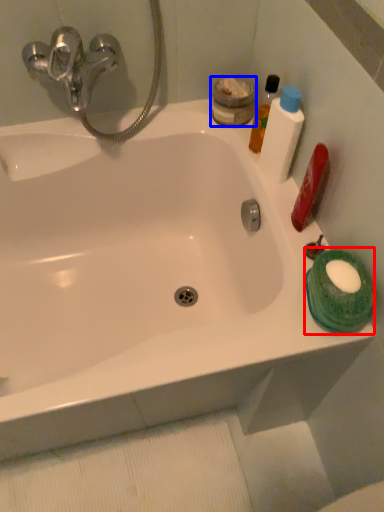
Question: Which point is closer to the camera, mouthwash (highlighted by a red box) or mouthwash (highlighted by a blue box)?

Choices:
 (A) mouthwash
 (B) mouthwash

Answer: (A)